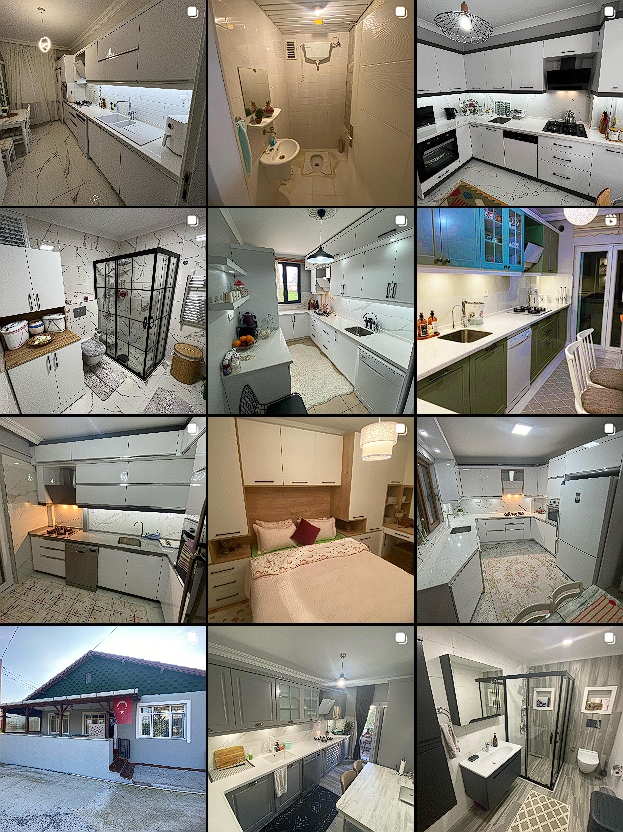
Where is `front windows`? front windows is located at coordinates (145, 724), (159, 724), (174, 724), (177, 701), (159, 705), (141, 706), (65, 721), (55, 721).